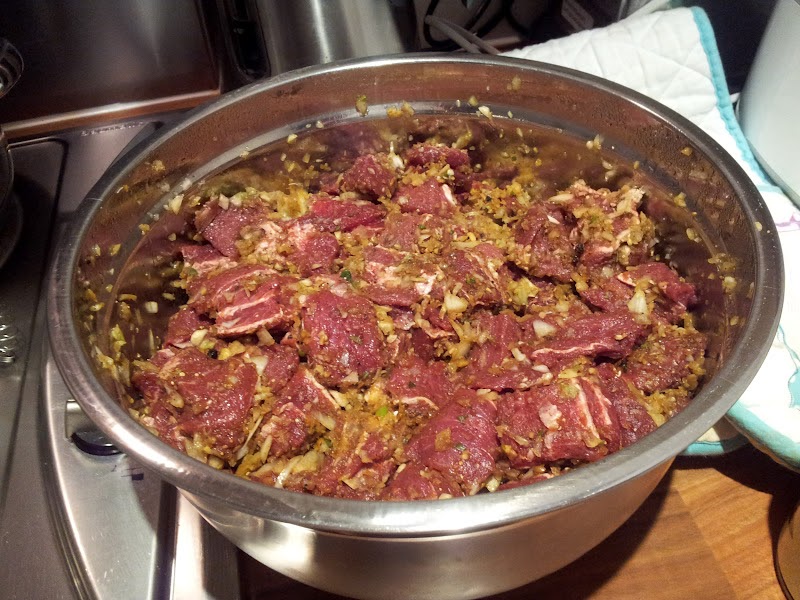
Locate an element on the screen. The height and width of the screenshot is (600, 800). silver wall is located at coordinates (313, 29), (138, 34).